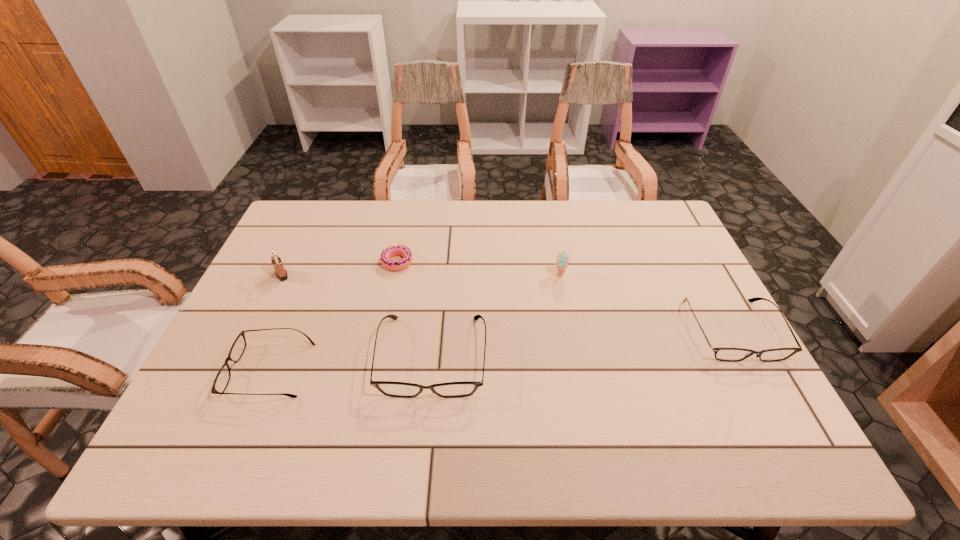
Where is `free spot between the third shortest object and the second spectacles from right to left`? free spot between the third shortest object and the second spectacles from right to left is located at coordinates (583, 343).

At what (x,y) coordinates should I click in order to perform the action: click on free space between the rightmost object and the second spectacles from left to right. Please return your answer as a coordinate pair (x, y). Looking at the image, I should click on (583, 343).

I want to click on free space that is in between the second spectacles from left to right and the second object from right to left, so [496, 315].

Locate an element on the screen. The width and height of the screenshot is (960, 540). free area in between the second spectacles from right to left and the padlock is located at coordinates (357, 315).

Where is `free point between the second spectacles from right to left and the rightmost object`? free point between the second spectacles from right to left and the rightmost object is located at coordinates (583, 343).

You are a GUI agent. You are given a task and a screenshot of the screen. Output one action in this format:
    pyautogui.click(x=<x>, y=<y>)
    Task: Click on the vacant point located between the rightmost object and the padlock
    
    Given the screenshot: What is the action you would take?
    pyautogui.click(x=507, y=302)

Identify the location of free spot between the second spectacles from left to right and the second object from right to left. (496, 315).

The width and height of the screenshot is (960, 540). What are the coordinates of `free spot between the second shortest object and the rightmost object` in the screenshot? It's located at (501, 350).

Locate an element on the screen. Image resolution: width=960 pixels, height=540 pixels. unoccupied position between the padlock and the second spectacles from left to right is located at coordinates (357, 315).

The height and width of the screenshot is (540, 960). What are the coordinates of `free space between the padlock and the doughnut` in the screenshot? It's located at (340, 268).